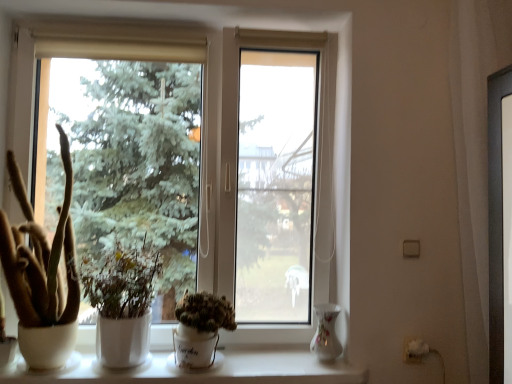
In order to click on free space to the left of porcelain floral vase at lower right in this screenshot , I will do `click(286, 360)`.